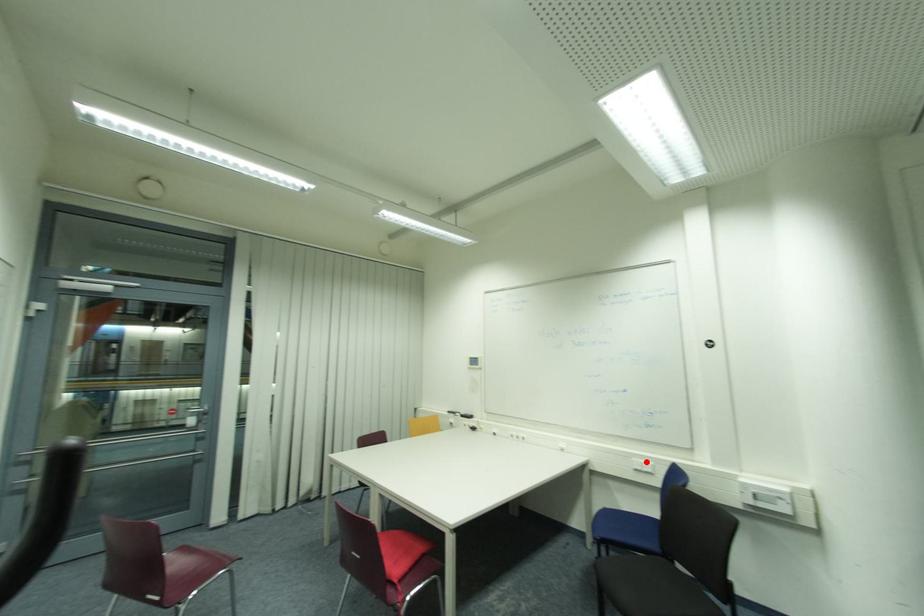
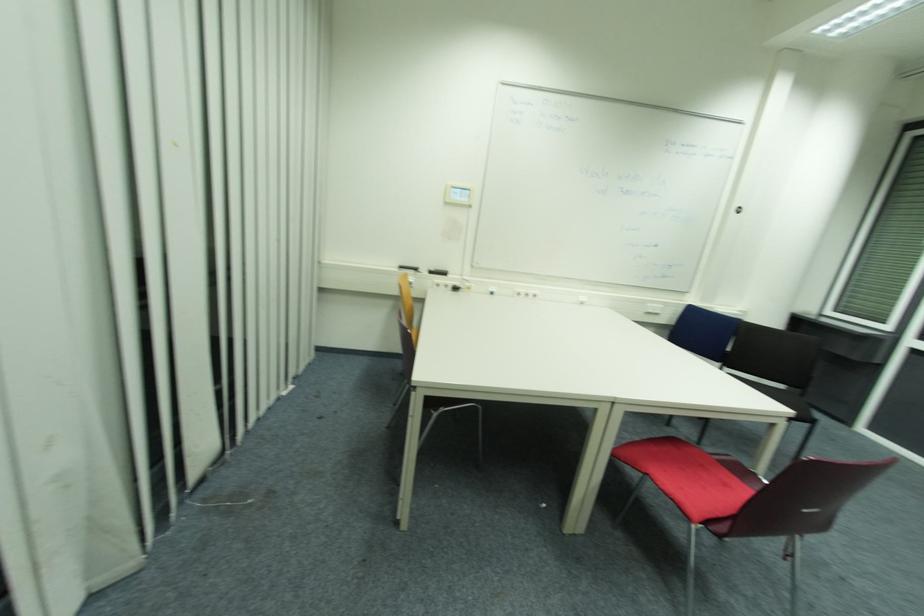
Where in the second image is the point corresponding to the highlighted location from the first image?

(658, 306)